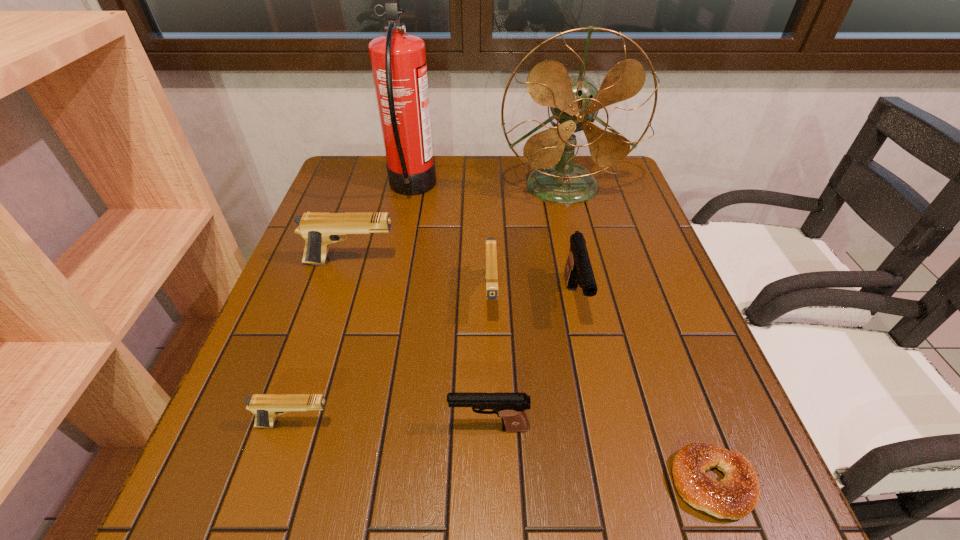
At what (x,y) coordinates should I click in order to perform the action: click on free region located 0.150m at the barrel of the nearer black pistol. Please return your answer as a coordinate pair (x, y). Image resolution: width=960 pixels, height=540 pixels. Looking at the image, I should click on (364, 427).

What are the coordinates of `free point located at the barrel of the nearer black pistol` in the screenshot? It's located at (306, 427).

The image size is (960, 540). Identify the location of vacant space situated 0.250m at the barrel of the seventh tallest object. (477, 424).

Where is `free location located 0.140m on the back of the shortest object`? Image resolution: width=960 pixels, height=540 pixels. free location located 0.140m on the back of the shortest object is located at coordinates (674, 377).

The image size is (960, 540). What are the coordinates of `fire extinguisher located at the far edge` in the screenshot? It's located at (398, 60).

What are the coordinates of `fan present at the far edge` in the screenshot? It's located at (574, 100).

Locate an element on the screen. object present at the near edge is located at coordinates (733, 497).

Find the location of a particular element. This screenshot has width=960, height=540. fan that is at the right edge is located at coordinates (574, 100).

This screenshot has height=540, width=960. Find the location of `bagel located at the right edge`. bagel located at the right edge is located at coordinates (733, 497).

The image size is (960, 540). I want to click on object at the far right corner, so click(574, 100).